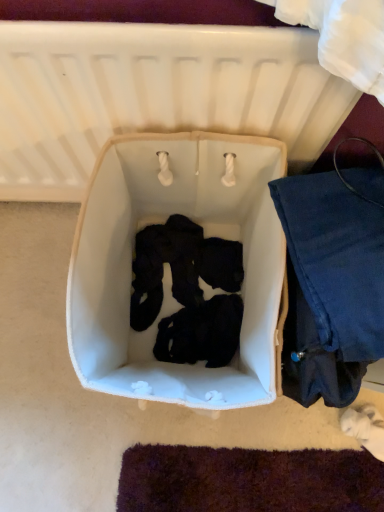
In order to face white fabric laundry basket at center, should I rotate leftwards or rightwards?

Turn left by 1.027 degrees to look at white fabric laundry basket at center.

The image size is (384, 512). Describe the element at coordinates (167, 267) in the screenshot. I see `white fabric laundry basket at center` at that location.

What do you see at coordinates (332, 281) in the screenshot?
I see `denim fabric pants at right` at bounding box center [332, 281].

Where is `white fabric laundry basket at center`? white fabric laundry basket at center is located at coordinates (167, 267).

Locate an element on the screen. This screenshot has height=512, width=384. clothing behind the white fabric infant bed at center is located at coordinates (332, 281).

Considering the positions of objects denim fabric pants at right and white fabric infant bed at center in the image provided, who is behind, denim fabric pants at right or white fabric infant bed at center?

denim fabric pants at right is behind.

Is denim fabric pants at right located outside white fabric infant bed at center?

Absolutely, denim fabric pants at right is external to white fabric infant bed at center.

Is denim fabric pants at right positioned far away from white fabric infant bed at center?

denim fabric pants at right is near white fabric infant bed at center, not far away.

Consider the image. Is the position of white fabric infant bed at center less distant than that of denim fabric pants at right?

Yes, it is.

Can you confirm if white fabric infant bed at center is taller than denim fabric pants at right?

Yes, white fabric infant bed at center is taller than denim fabric pants at right.

Find the location of a particular element. Image resolution: width=384 pixels, height=512 pixels. infant bed on the left side of denim fabric pants at right is located at coordinates (153, 94).

Considering the points (205, 54) and (345, 182), which point is in front, point (205, 54) or point (345, 182)?

The point (205, 54) is in front.

In terms of height, does white fabric laundry basket at center look taller or shorter compared to denim fabric pants at right?

In the image, white fabric laundry basket at center appears to be shorter than denim fabric pants at right.

Is white fabric laundry basket at center directly adjacent to denim fabric pants at right?

They are not placed beside each other.

Is white fabric laundry basket at center in front of denim fabric pants at right?

No, white fabric laundry basket at center is behind denim fabric pants at right.

Could you tell me if white fabric laundry basket at center is facing denim fabric pants at right?

No, white fabric laundry basket at center is not facing towards denim fabric pants at right.

From a real-world perspective, between white fabric infant bed at center and white fabric laundry basket at center, who is vertically lower?

white fabric laundry basket at center.

Is white fabric laundry basket at center inside white fabric infant bed at center?

No, white fabric laundry basket at center is located outside of white fabric infant bed at center.

Considering the sizes of objects white fabric infant bed at center and white fabric laundry basket at center in the image provided, who is shorter, white fabric infant bed at center or white fabric laundry basket at center?

white fabric laundry basket at center.

Considering the positions of objects white fabric laundry basket at center and white fabric infant bed at center in the image provided, who is in front, white fabric laundry basket at center or white fabric infant bed at center?

white fabric infant bed at center.

From a real-world perspective, which is physically above, white fabric laundry basket at center or white fabric infant bed at center?

white fabric infant bed at center.

Is white fabric laundry basket at center spatially inside white fabric infant bed at center, or outside of it?

white fabric laundry basket at center is outside white fabric infant bed at center.

Which is behind, denim fabric pants at right or white fabric laundry basket at center?

white fabric laundry basket at center is further from the camera.

Is there a large distance between denim fabric pants at right and white fabric laundry basket at center?

They are positioned close to each other.

Where is `clothing lying in front of the white fabric laundry basket at center`? This screenshot has height=512, width=384. clothing lying in front of the white fabric laundry basket at center is located at coordinates (332, 281).

Which of these two, denim fabric pants at right or white fabric laundry basket at center, is wider?

white fabric laundry basket at center.

This screenshot has width=384, height=512. I want to click on infant bed positioned vertically above the denim fabric pants at right (from a real-world perspective), so click(x=153, y=94).

Where is `clothing below the white fabric infant bed at center (from the image's perspective)`? The image size is (384, 512). clothing below the white fabric infant bed at center (from the image's perspective) is located at coordinates (332, 281).

Based on their spatial positions, is white fabric infant bed at center or denim fabric pants at right closer to white fabric laundry basket at center?

denim fabric pants at right.

Estimate the real-world distances between objects in this image. Which object is further from white fabric laundry basket at center, denim fabric pants at right or white fabric infant bed at center?

Based on the image, white fabric infant bed at center appears to be further to white fabric laundry basket at center.

Considering their positions, is white fabric laundry basket at center positioned closer to denim fabric pants at right than white fabric infant bed at center?

white fabric laundry basket at center is positioned closer to the anchor denim fabric pants at right.

Looking at the image, which one is located further to denim fabric pants at right, white fabric infant bed at center or white fabric laundry basket at center?

white fabric infant bed at center lies further to denim fabric pants at right than the other object.

Which object lies nearer to the anchor point white fabric infant bed at center, white fabric laundry basket at center or denim fabric pants at right?

Based on the image, white fabric laundry basket at center appears to be nearer to white fabric infant bed at center.

Consider the image. Based on their spatial positions, is denim fabric pants at right or white fabric laundry basket at center closer to white fabric infant bed at center?

Based on the image, white fabric laundry basket at center appears to be nearer to white fabric infant bed at center.

This screenshot has width=384, height=512. Find the location of `baby carriage situated between white fabric infant bed at center and denim fabric pants at right from left to right`. baby carriage situated between white fabric infant bed at center and denim fabric pants at right from left to right is located at coordinates (167, 267).